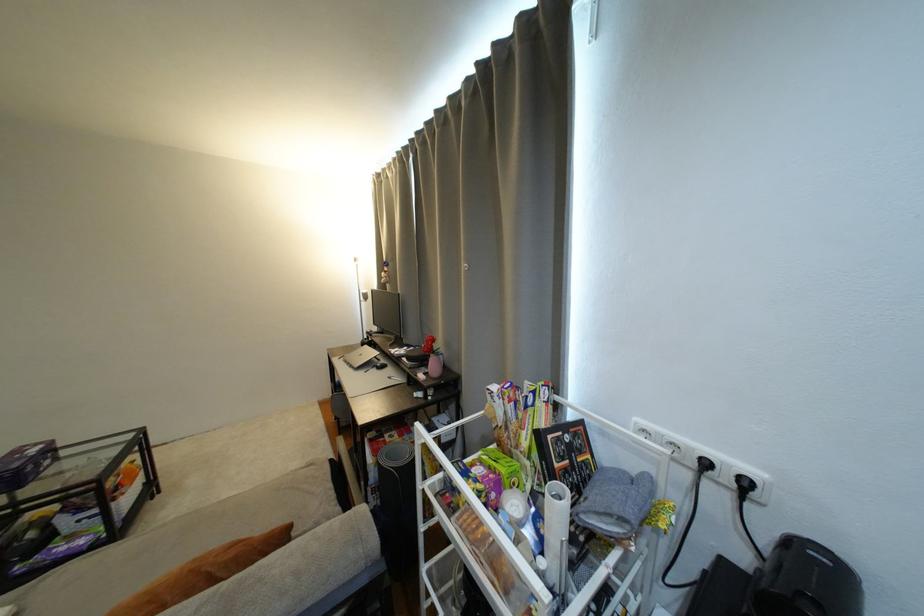
Find where to lift the cereal box. Please return your answer as a coordinate pair (x, y).

(517, 411)